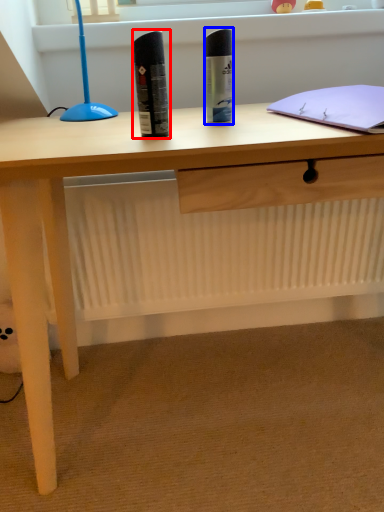
Question: Which of the following is the farthest to the observer, stationery (highlighted by a red box) or stationery (highlighted by a blue box)?

Choices:
 (A) stationery
 (B) stationery

Answer: (B)